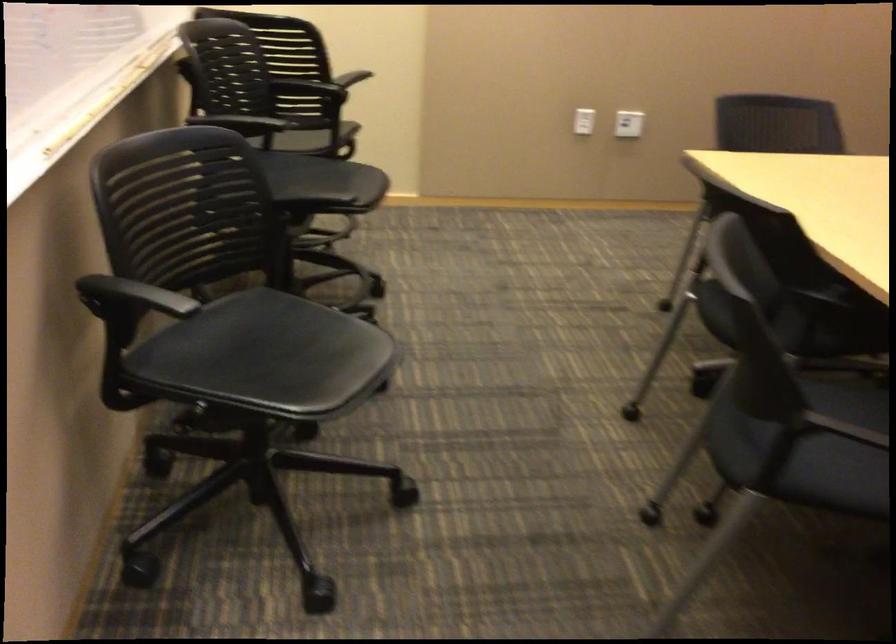
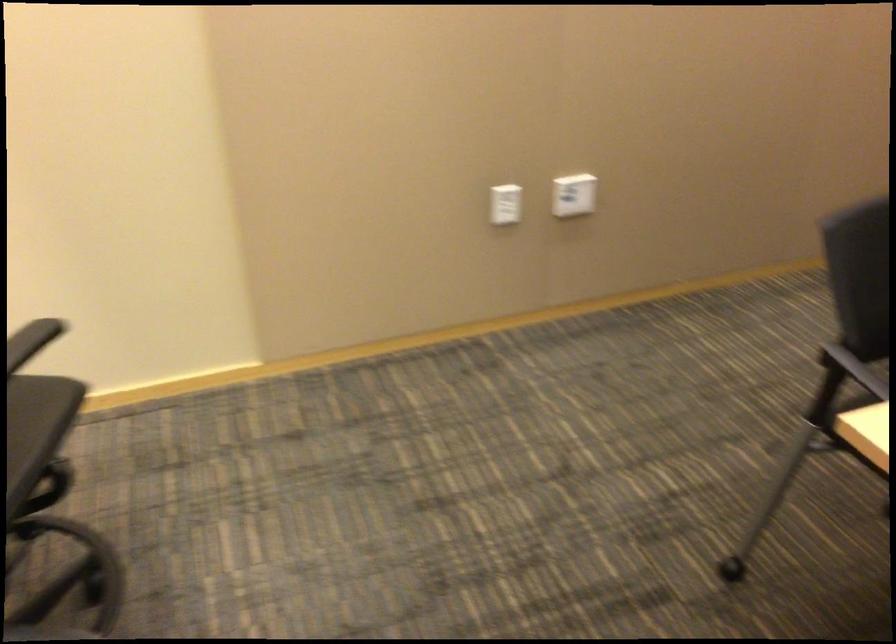
Question: Which direction would the cameraman need to move to produce the second image? Reply with the corresponding letter.

Choices:
 (A) Left
 (B) Right
 (C) Forward
 (D) Backward

Answer: (C)